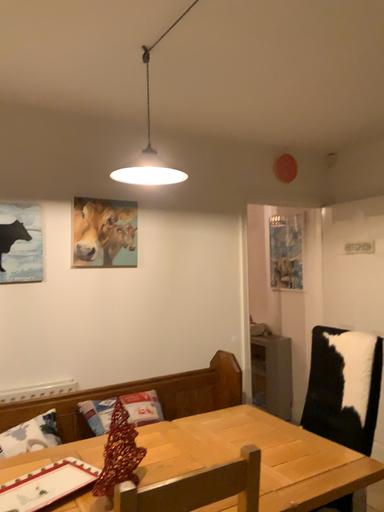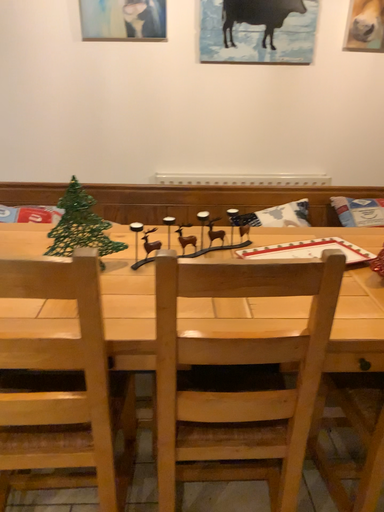
Question: Which way did the camera rotate in the video?

Choices:
 (A) rotated left
 (B) rotated right

Answer: (A)